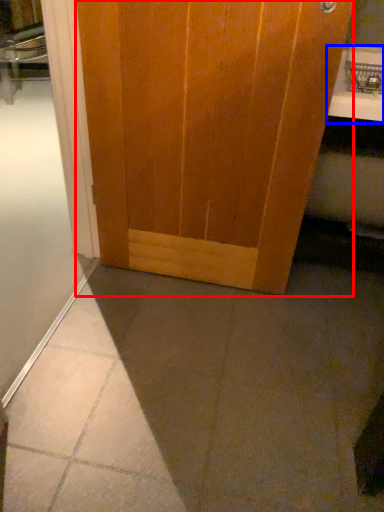
Question: Which object appears closest to the camera in this image, door (highlighted by a red box) or counter top (highlighted by a blue box)?

Choices:
 (A) door
 (B) counter top

Answer: (A)